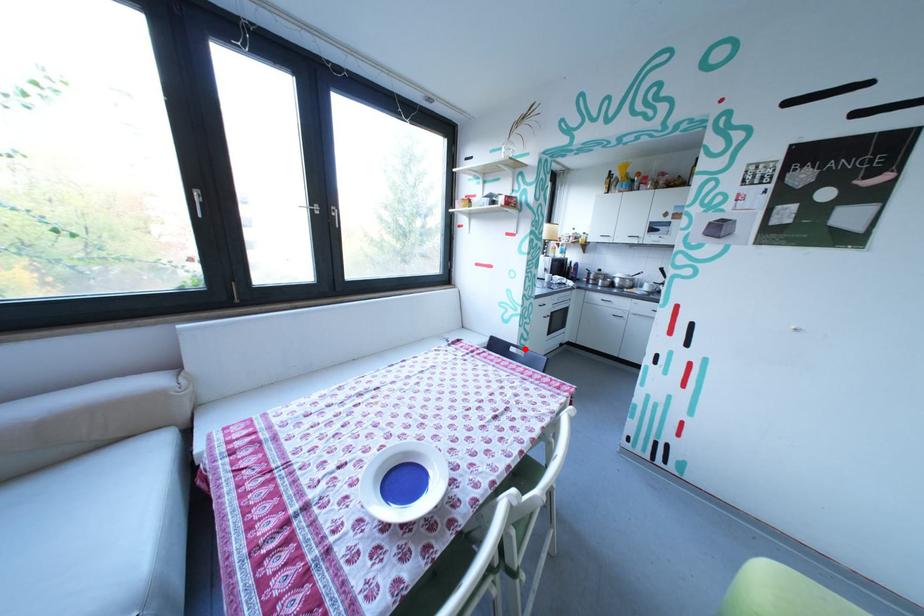
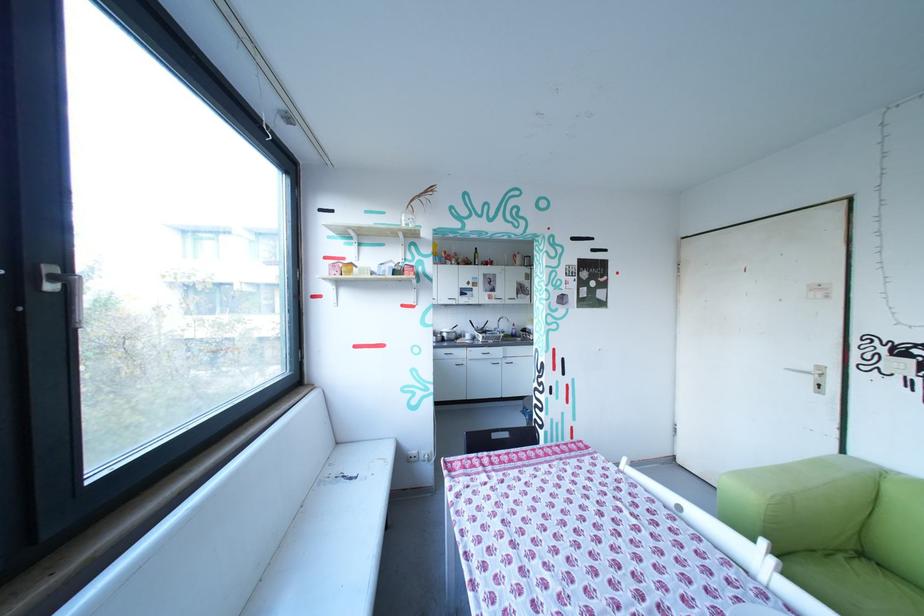
Question: I am providing you with two images of the same scene from different viewpoints. A red point is shown in image1. For the corresponding object point in image2, is it positioned nearer or farther from the camera?

Choices:
 (A) Nearer
 (B) Farther

Answer: (A)